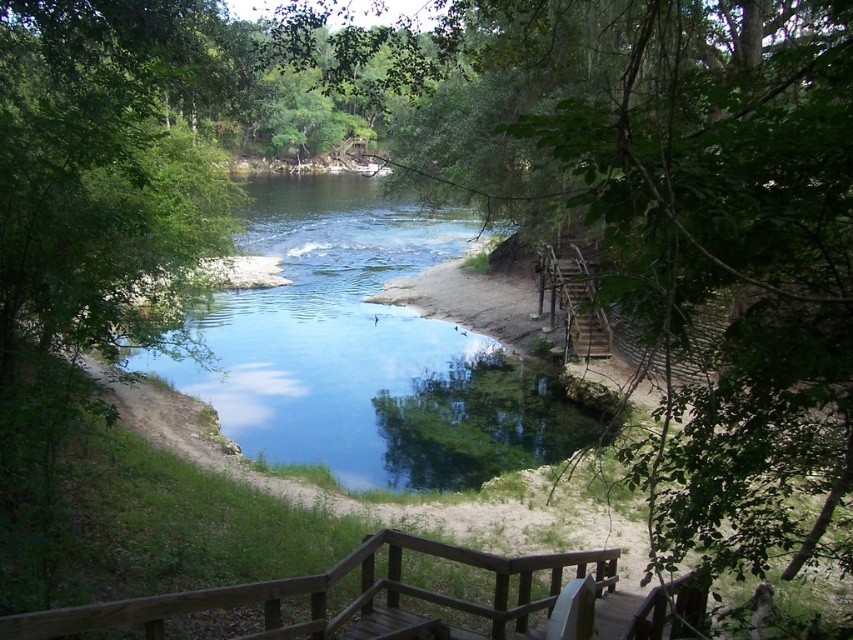
You are planning to cross from the wooden stairs at right to the clear water at center. What should you consider about their widths?

The clear water at center might be wider than wooden stairs at right, so you need to check the width before crossing to ensure safe passage.

You are planning to build a small boat dock at the water edge. The dock needs to be placed between the clear water at center and the wooden stairs at right. Given that the distance between them is 47.44 feet, can a standard 20 feet long dock fit in that space without overlapping either of them?

The distance between the clear water at center and the wooden stairs at right is 47.44 feet. A standard 20 feet long dock can easily fit within this space without overlapping either the clear water at center or the wooden stairs at right since 20 feet is significantly shorter than 47.44 feet.